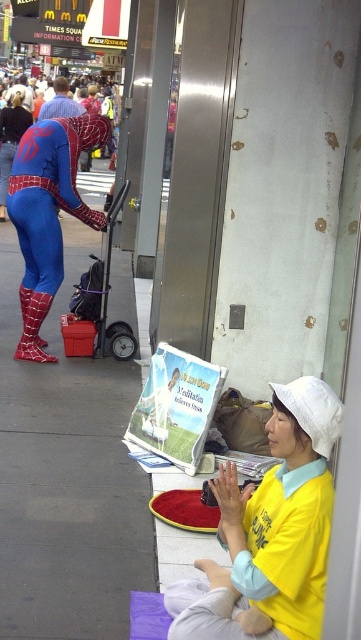
You are a delivery person trying to navigate through the scene. You need to place a large box on the ground. Which location would be more stable for placing the box, the concrete sidewalk at lower left or the shiny spandex suit at left?

The concrete sidewalk at lower left is more stable because it is a solid surface, unlike the shiny spandex suit at left which is a flexible material and not as tall.

You are a street vendor in Times Square. You have a matte paper comic book at lower center and a blue spandex suit at left. Which item is taller?

The blue spandex suit at left is taller than the matte paper comic book at lower center.

You are navigating an urban area and need to reach a destination directly across from the concrete sidewalk at lower left. Given that the sidewalk is at coordinates point 0.744, 0.186, can you determine the shortest path to reach the destination without crossing any obstacles?

The concrete sidewalk at lower left is located at point (67,476). To reach the destination directly across from it, you should walk straight along the sidewalk towards the opposite direction of the coordinates provided, ensuring you stay on the path and avoid obstacles like the Spider Man costume figure and the woman sitting nearby.